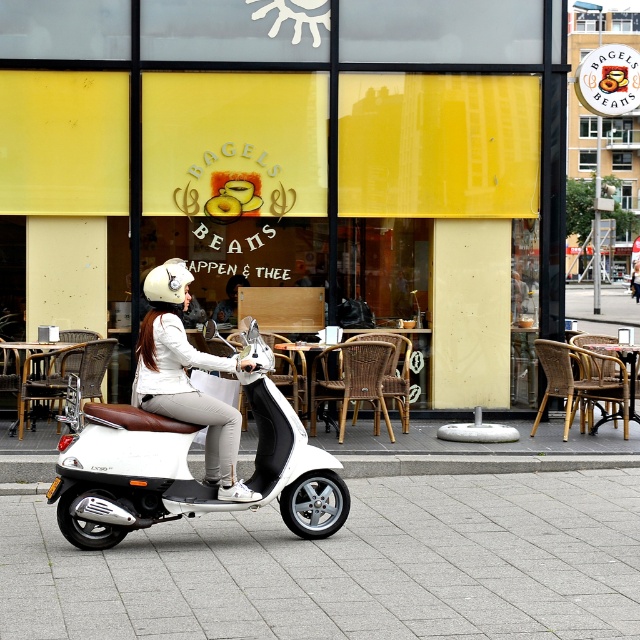
Question: Observing the image, what is the correct spatial positioning of yellow matte glass at center in reference to white matte helmet at upper left?

Choices:
 (A) above
 (B) below

Answer: (A)

Question: Which object is closer to the camera taking this photo?

Choices:
 (A) yellow matte glass at center
 (B) white matte scooter at center
 (C) white matte helmet at upper left

Answer: (B)

Question: Estimate the real-world distances between objects in this image. Which object is farther from the white matte scooter at center?

Choices:
 (A) yellow matte glass at center
 (B) white matte helmet at upper left

Answer: (A)

Question: Which object is the closest to the white matte scooter at center?

Choices:
 (A) white matte helmet at upper left
 (B) yellow matte glass at center

Answer: (A)

Question: Can you confirm if white matte scooter at center is wider than white matte helmet at upper left?

Choices:
 (A) yes
 (B) no

Answer: (A)

Question: Is yellow matte glass at center to the left of white matte helmet at upper left from the viewer's perspective?

Choices:
 (A) no
 (B) yes

Answer: (B)